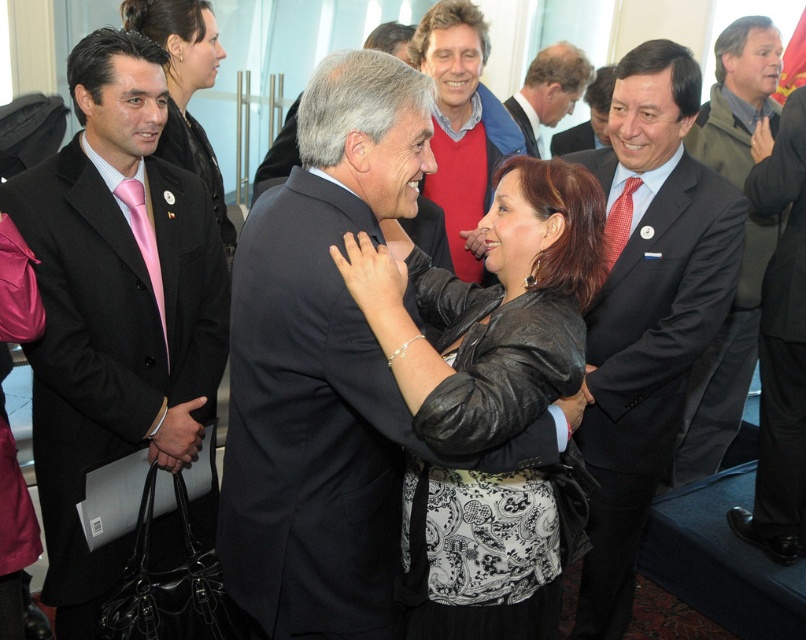
Measure the distance from black matte suit at center to black leather jacket at center.

A distance of 7.07 inches exists between black matte suit at center and black leather jacket at center.

Looking at this image, measure the distance from black matte suit at center to black leather jacket at center.

7.07 inches

Which is in front, point (339, 432) or point (578, 358)?

Point (578, 358) is more forward.

Identify the location of black matte suit at center. This screenshot has width=806, height=640. (310, 428).

Is black matte suit at center thinner than dark gray suit at center?

In fact, black matte suit at center might be wider than dark gray suit at center.

Who is shorter, black matte suit at center or dark gray suit at center?

black matte suit at center

Who is more forward, (252, 385) or (763, 452)?

Positioned in front is point (252, 385).

The width and height of the screenshot is (806, 640). Find the location of `black matte suit at center`. black matte suit at center is located at coordinates (310, 428).

Is green woolen sweater at upper right to the right of light brown leather jacket at upper center from the viewer's perspective?

Correct, you'll find green woolen sweater at upper right to the right of light brown leather jacket at upper center.

Is green woolen sweater at upper right to the left of light brown leather jacket at upper center from the viewer's perspective?

No, green woolen sweater at upper right is not to the left of light brown leather jacket at upper center.

This screenshot has height=640, width=806. I want to click on green woolen sweater at upper right, so click(x=725, y=365).